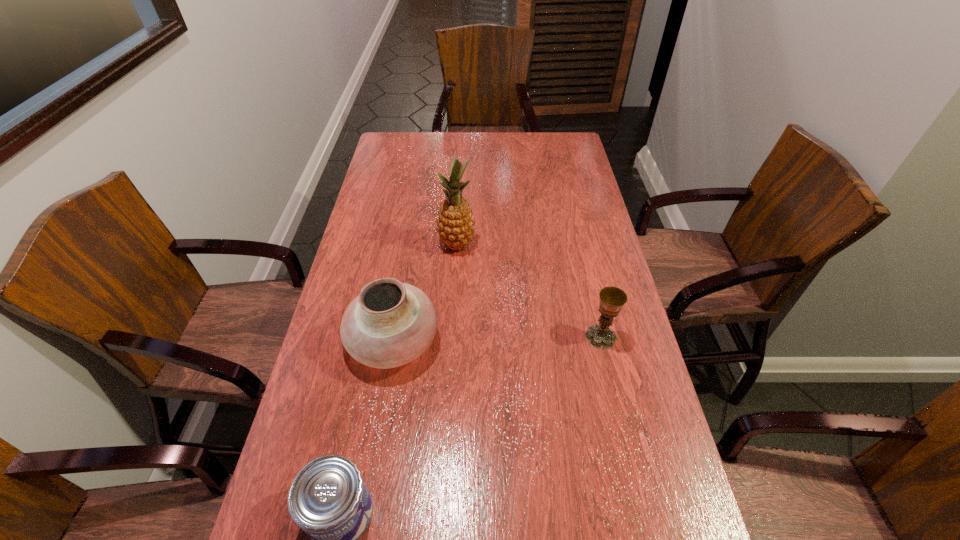
The height and width of the screenshot is (540, 960). What are the coordinates of `free space between the tallest object and the rightmost object` in the screenshot? It's located at (529, 291).

Image resolution: width=960 pixels, height=540 pixels. What are the coordinates of `object identified as the third closest to the rightmost object` in the screenshot? It's located at (328, 499).

Locate which object is the second closest to the pottery. Please provide its 2D coordinates. Your answer should be formatted as a tuple, i.e. [(x, y)], where the tuple contains the x and y coordinates of a point satisfying the conditions above.

[(328, 499)]